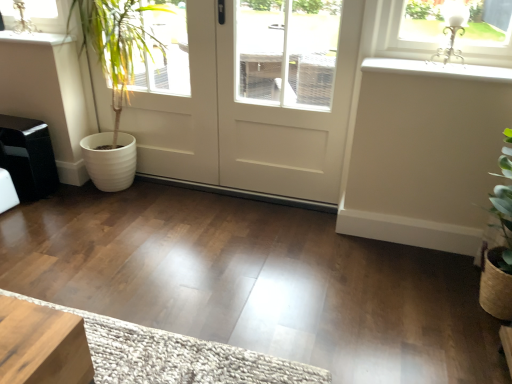
Image resolution: width=512 pixels, height=384 pixels. I want to click on vacant space underneath white textured doormat at lower center (from a real-world perspective), so click(165, 362).